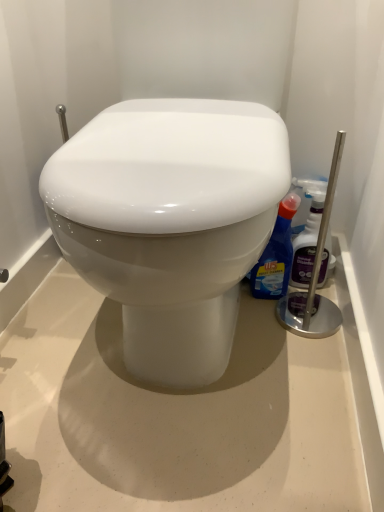
The height and width of the screenshot is (512, 384). I want to click on vacant space in front of translucent plastic spray bottle at right, which is the second cleaning product from left to right, so click(x=306, y=331).